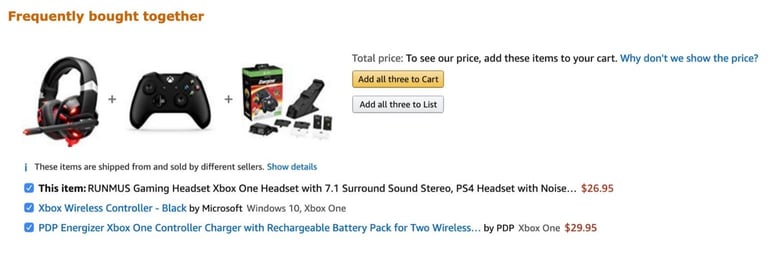
The image size is (772, 254). Find the location of `game console`. game console is located at coordinates (x=173, y=91).